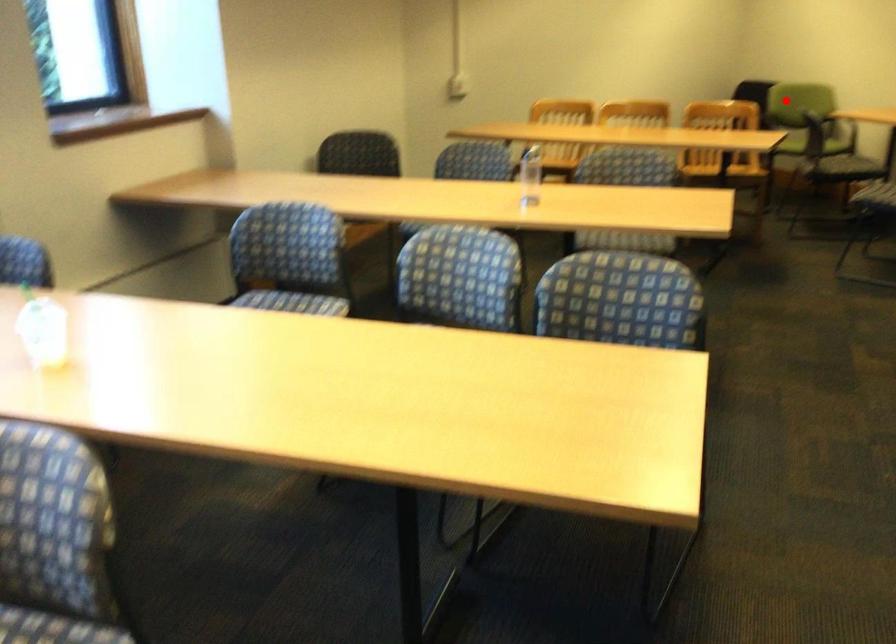
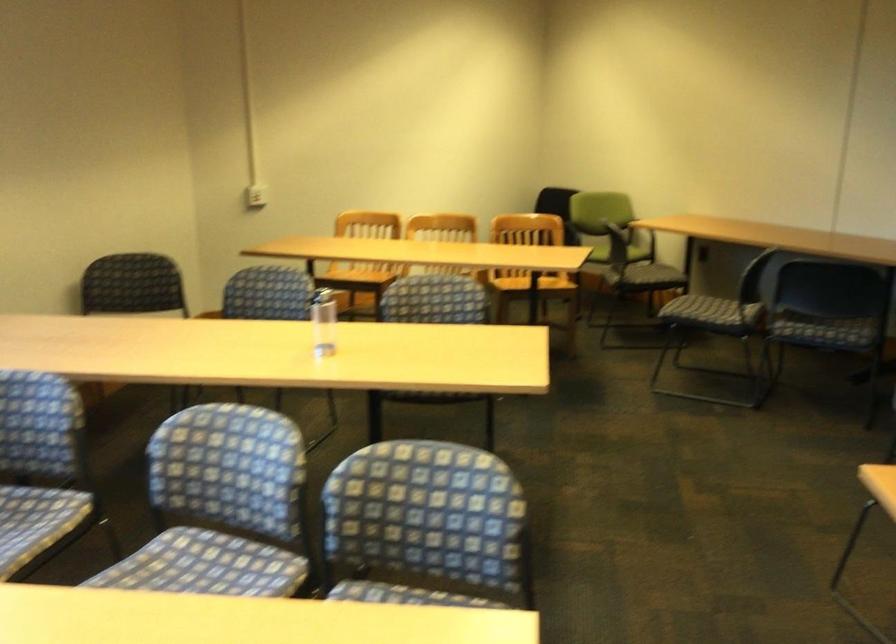
Question: I am providing you with two images of the same scene from different viewpoints. Given a red point in image1, look at the same physical point in image2. Is it:

Choices:
 (A) Closer to the viewpoint
 (B) Farther from the viewpoint

Answer: (B)